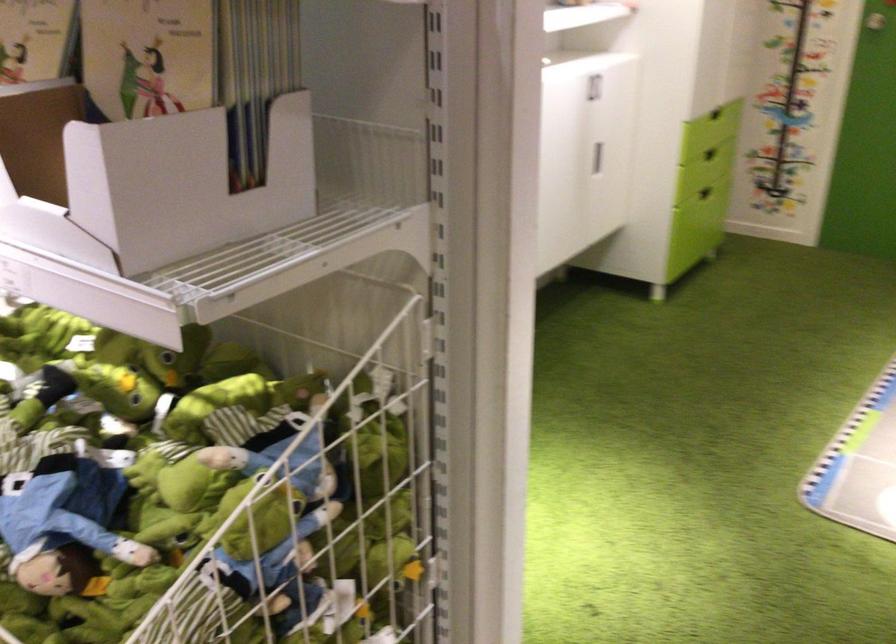
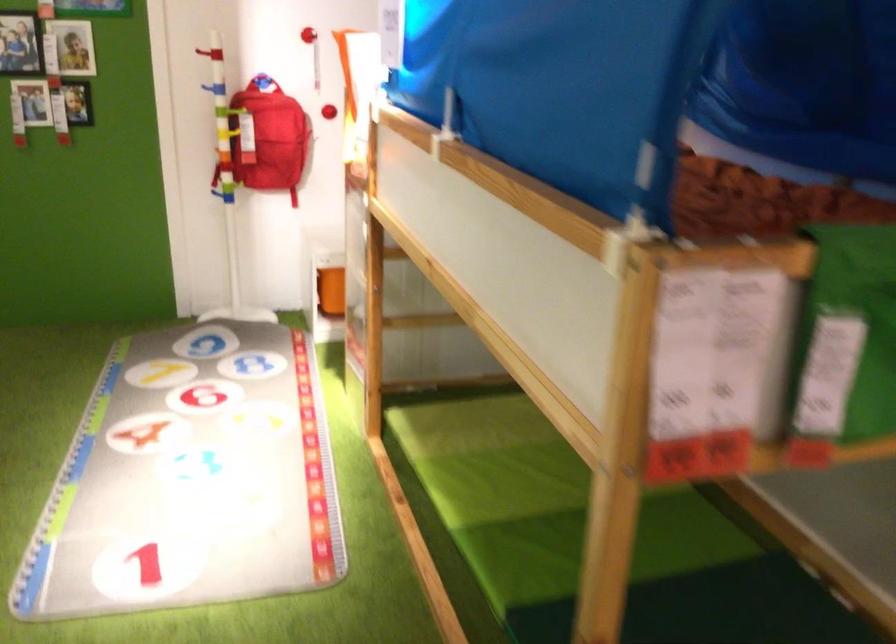
Question: The camera is either moving clockwise (left) or counter-clockwise (right) around the object. The first image is from the beginning of the video and the second image is from the end. Is the camera moving left or right when shooting the video?

Choices:
 (A) Left
 (B) Right

Answer: (A)